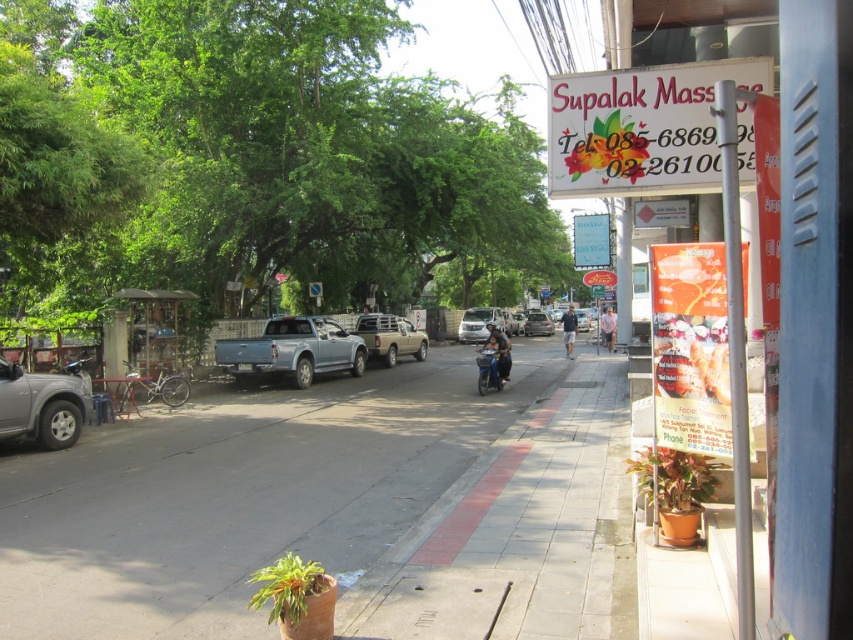
You are a delivery person standing at the camera position. You need to deliver a package to the Supalak Massage store on the right. The silver metallic suv at left is blocking the path. Can you walk around the suv to reach the store?

The silver metallic suv at left is 32.12 feet away from camera. Since the suv is blocking the path, you can walk around it to reach the Supalak Massage store on the right as long as there is enough space on either side of the suv to navigate around it safely.

You are standing at the Supalak Massage store entrance and want to walk towards the point labeled as point (463, 340). Which direction should you move relative to point (616, 83)?

Since point (616, 83) is in front of point (463, 340), you should move away from point (616, 83) to reach point (463, 340).